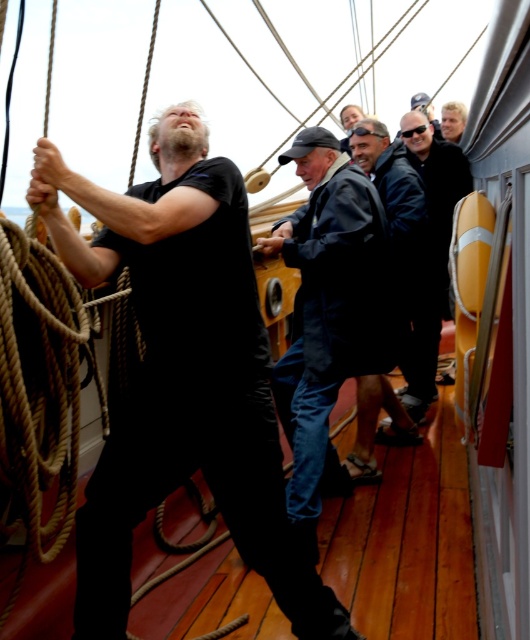
Based on the photo, can you confirm if dark blue jacket at center is thinner than dark blue jacket at right?

No, dark blue jacket at center is not thinner than dark blue jacket at right.

What do you see at coordinates (328, 310) in the screenshot? The height and width of the screenshot is (640, 530). I see `dark blue jacket at center` at bounding box center [328, 310].

The height and width of the screenshot is (640, 530). Identify the location of dark blue jacket at center. (328, 310).

Who is more forward, (x=419, y=198) or (x=431, y=316)?

Point (x=419, y=198) is more forward.

Does dark blue denim shorts at center appear over dark blue jacket at right?

Yes, dark blue denim shorts at center is above dark blue jacket at right.

Which is in front, point (364, 154) or point (445, 276)?

Positioned in front is point (364, 154).

I want to click on dark blue denim shorts at center, so click(x=393, y=189).

Which is below, dark blue jacket at center or dark blue denim shorts at center?

dark blue jacket at center

Consider the image. Who is more forward, (x=307, y=348) or (x=399, y=316)?

Positioned in front is point (x=307, y=348).

Find the location of `dark blue jacket at center`. dark blue jacket at center is located at coordinates (328, 310).